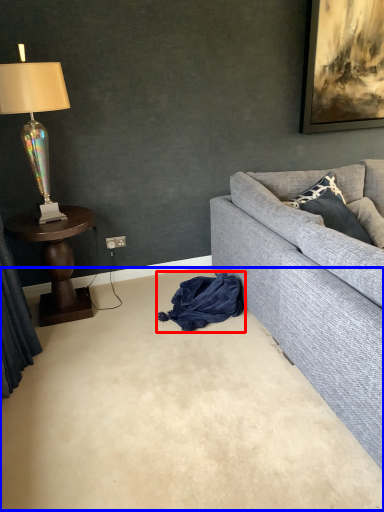
Question: Which object is closer to the camera taking this photo, material (highlighted by a red box) or plain (highlighted by a blue box)?

Choices:
 (A) material
 (B) plain

Answer: (B)